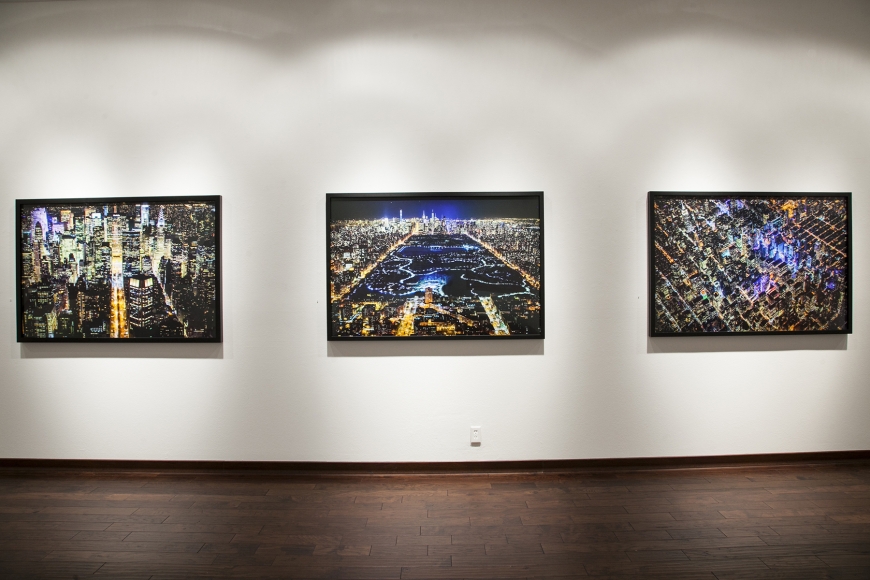
In order to click on floor in this screenshot , I will do `click(364, 500)`.